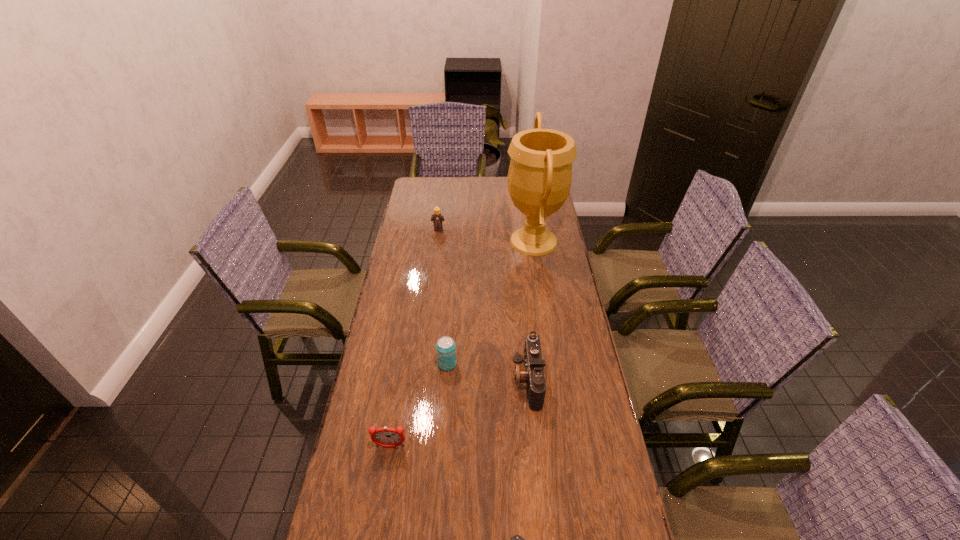
You are a GUI agent. You are given a task and a screenshot of the screen. Output one action in this format:
    pyautogui.click(x=<x>, y=<y>)
    Task: Click on the vacant space situated 0.150m on the front-facing side of the camera
    Image resolution: width=960 pixels, height=540 pixels.
    Given the screenshot: What is the action you would take?
    pyautogui.click(x=466, y=380)

You are a GUI agent. You are given a task and a screenshot of the screen. Output one action in this format:
    pyautogui.click(x=<x>, y=<y>)
    Task: Click on the vacant space located on the front-facing side of the camera
    The image size is (960, 540).
    Given the screenshot: What is the action you would take?
    425,380

The image size is (960, 540). Identify the location of vacant space located on the right of the third object from left to right. (560, 364).

Where is `vacant area situated on the front-facing side of the alarm clock`? Image resolution: width=960 pixels, height=540 pixels. vacant area situated on the front-facing side of the alarm clock is located at coordinates (386, 471).

This screenshot has height=540, width=960. Find the location of `Lego situated at the left edge`. Lego situated at the left edge is located at coordinates (437, 218).

Locate an element on the screen. The image size is (960, 540). alarm clock positioned at the left edge is located at coordinates (387, 437).

This screenshot has height=540, width=960. I want to click on object located at the right edge, so click(540, 173).

I want to click on vacant point at the far edge, so click(455, 198).

Image resolution: width=960 pixels, height=540 pixels. Find the location of `vacant space at the left edge`. vacant space at the left edge is located at coordinates (418, 239).

Find the location of `vacant space at the right edge`. vacant space at the right edge is located at coordinates (566, 311).